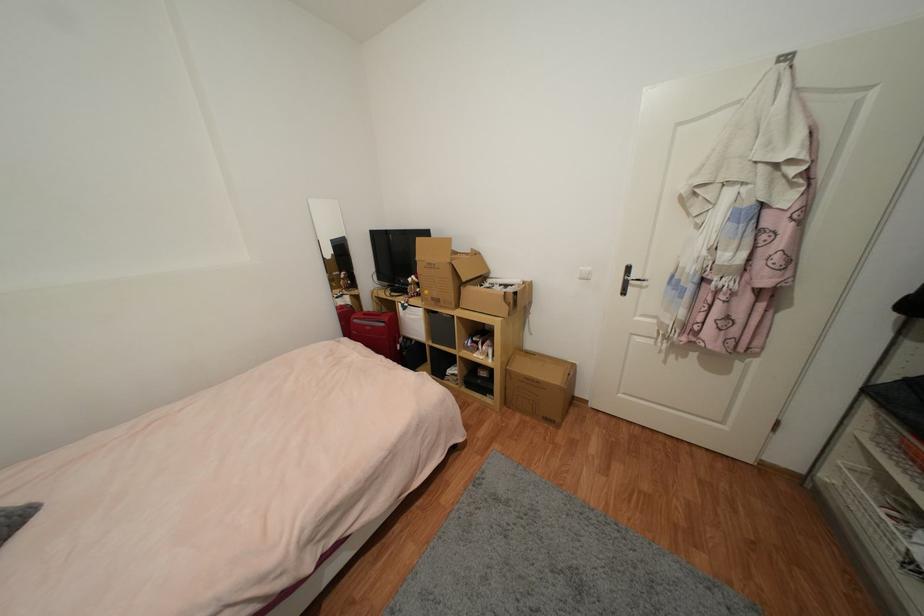
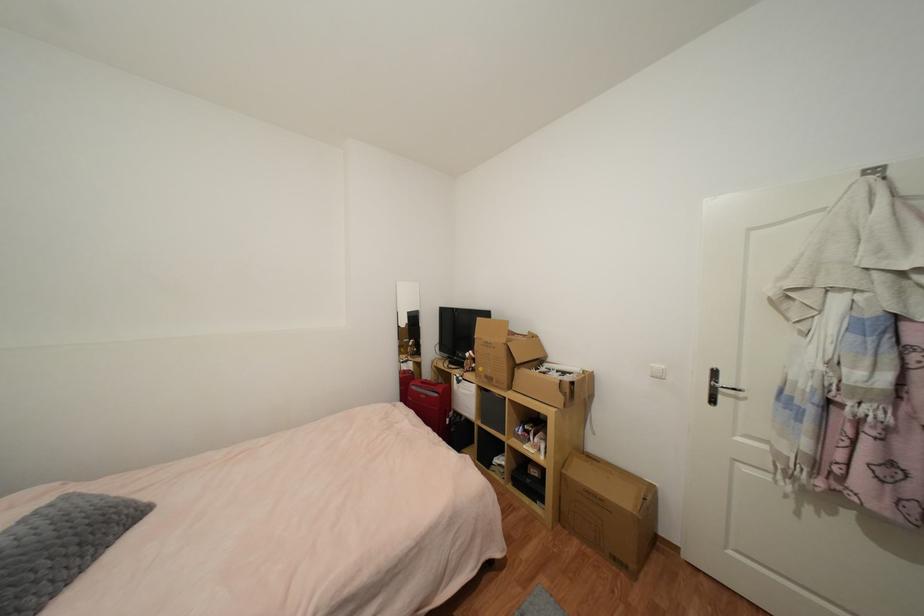
The point at (409,306) is marked in the first image. Where is the corresponding point in the second image?

(465, 379)